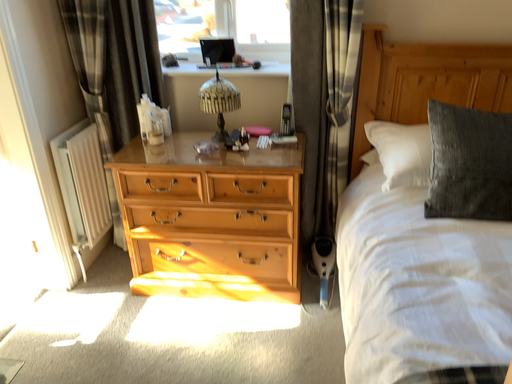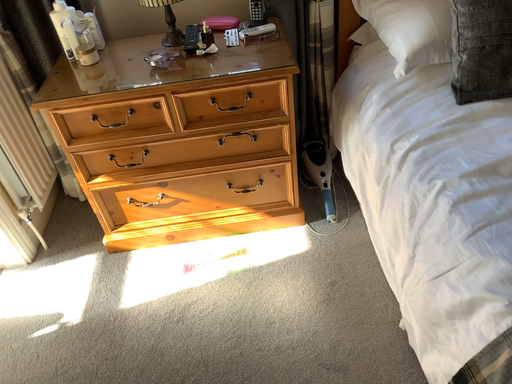
Question: How did the camera likely rotate when shooting the video?

Choices:
 (A) rotated upward
 (B) rotated downward

Answer: (B)